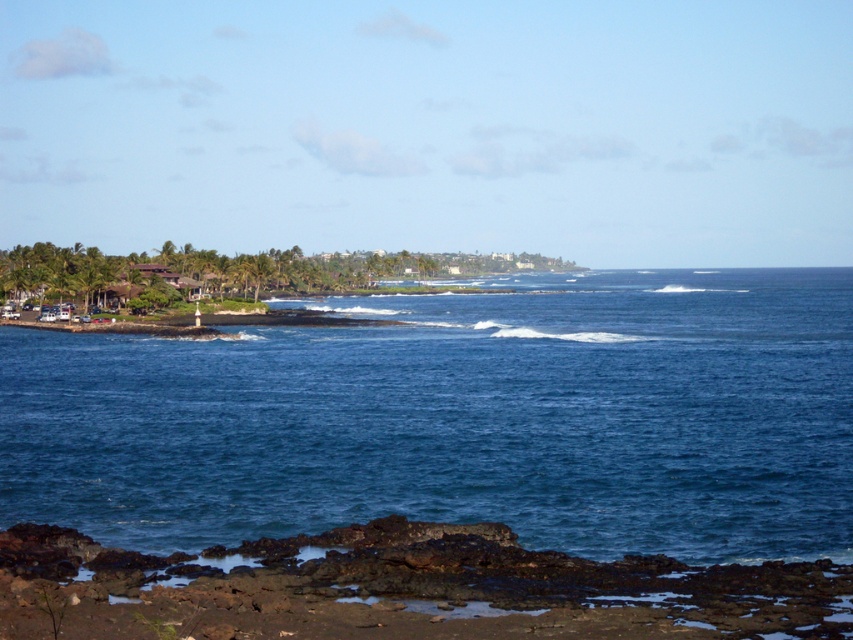
You are standing on the beach and see the blue water at center and the rusty rock at lower left. Which object appears taller from your viewpoint?

The blue water at center appears taller than the rusty rock at lower left.

You are standing on the shore and want to place a 1.2 meter wide floating dock between the blue water at center and the rusty rock at lower left. Can the space between them accommodate the dock?

The blue water at center might be wider than rusty rock at lower left, so it is possible that the space between them can accommodate the 1.2 meter wide floating dock. However, the exact width isn not specified, so you should measure the distance before deciding.